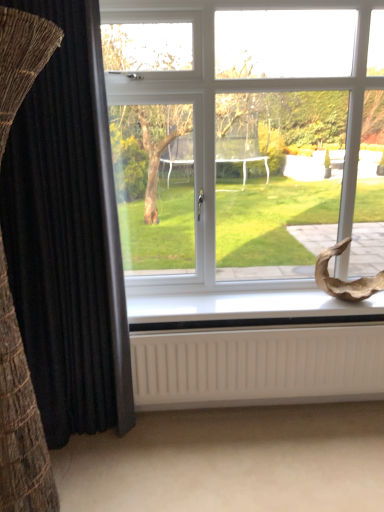
Question: From the image's perspective, is white plastic window at center located above or below black velvet curtain at left?

Choices:
 (A) below
 (B) above

Answer: (B)

Question: Visually, is white plastic window at center positioned to the left or to the right of black velvet curtain at left?

Choices:
 (A) left
 (B) right

Answer: (B)

Question: Which is farther from the white matte radiator at bottom?

Choices:
 (A) white plastic window at center
 (B) black velvet curtain at left
 (C) white plastic window sill at lower center

Answer: (A)

Question: Which object is positioned farthest from the white plastic window at center?

Choices:
 (A) white matte radiator at bottom
 (B) white plastic window sill at lower center
 (C) black velvet curtain at left

Answer: (C)